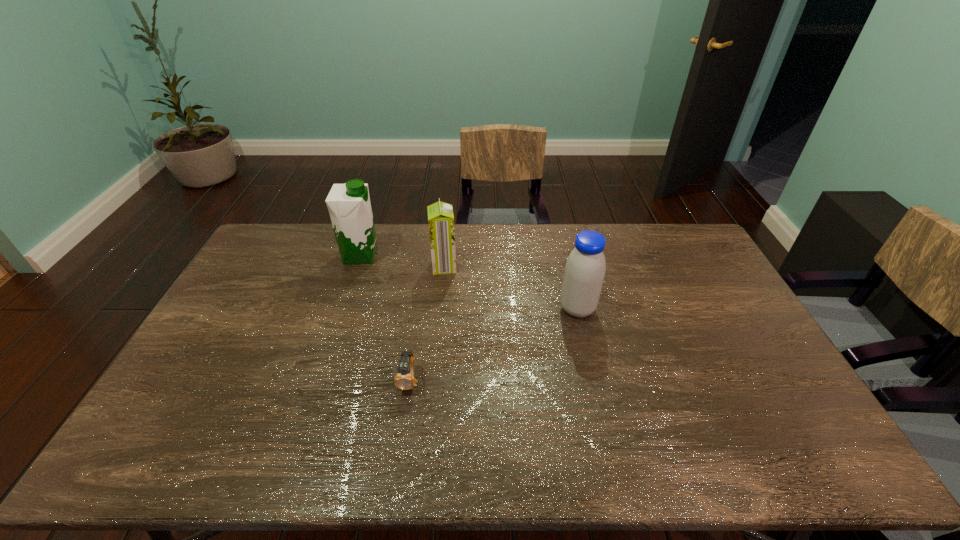
The width and height of the screenshot is (960, 540). Find the location of `free spot at the far edge of the desktop`. free spot at the far edge of the desktop is located at coordinates (542, 235).

Where is `free space at the near edge of the desktop`? free space at the near edge of the desktop is located at coordinates (229, 471).

Locate an element on the screen. Image resolution: width=960 pixels, height=540 pixels. free location at the left edge is located at coordinates (261, 277).

Where is `vacant area at the right edge`? vacant area at the right edge is located at coordinates (728, 374).

Where is `vacant space at the near left corner of the desktop`? This screenshot has width=960, height=540. vacant space at the near left corner of the desktop is located at coordinates (201, 436).

Where is `blank region between the nearest object and the leftmost object`? blank region between the nearest object and the leftmost object is located at coordinates (385, 318).

Identify the location of free area in between the watch and the leftmost soya milk. The width and height of the screenshot is (960, 540). (385, 318).

Where is `blank region between the shortest object and the leftmost soya milk`? This screenshot has width=960, height=540. blank region between the shortest object and the leftmost soya milk is located at coordinates (385, 318).

Image resolution: width=960 pixels, height=540 pixels. Find the location of `vacant area between the watch and the second soya milk from right to left`. vacant area between the watch and the second soya milk from right to left is located at coordinates (427, 323).

The width and height of the screenshot is (960, 540). Find the location of `free space between the nearest object and the second soya milk from right to left`. free space between the nearest object and the second soya milk from right to left is located at coordinates (427, 323).